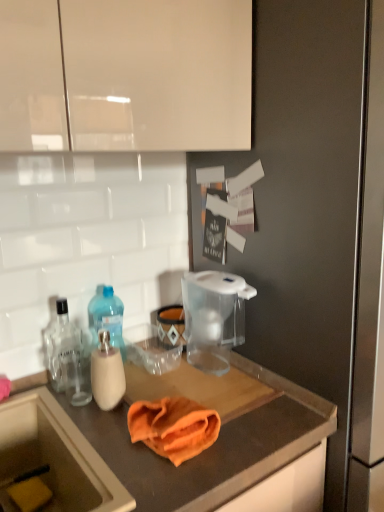
Question: From the image's perspective, is transparent plastic pitcher at upper center below translucent plastic bottle at left, the 1th bottle positioned from the right?

Choices:
 (A) no
 (B) yes

Answer: (B)

Question: Is translucent plastic bottle at left, which is the second bottle in left-to-right order, located within transparent plastic pitcher at upper center?

Choices:
 (A) no
 (B) yes

Answer: (A)

Question: Are transparent plastic pitcher at upper center and translucent plastic bottle at left, the 1th bottle positioned from the right, located far from each other?

Choices:
 (A) yes
 (B) no

Answer: (B)

Question: From a real-world perspective, is transparent plastic pitcher at upper center under translucent plastic bottle at left, the 1th bottle positioned from the right?

Choices:
 (A) yes
 (B) no

Answer: (A)

Question: Is transparent plastic pitcher at upper center positioned beyond the bounds of translucent plastic bottle at left, which is the second bottle in left-to-right order?

Choices:
 (A) yes
 (B) no

Answer: (A)

Question: Is transparent plastic pitcher at upper center at the right side of translucent plastic bottle at left, the 1th bottle positioned from the right?

Choices:
 (A) yes
 (B) no

Answer: (A)

Question: Is clear glass bottle at left, marked as the 1th bottle in a left-to-right arrangement, positioned beyond the bounds of transparent plastic water filter pitcher at center?

Choices:
 (A) yes
 (B) no

Answer: (A)

Question: Is clear glass bottle at left, which is the 2th bottle from right to left, next to transparent plastic water filter pitcher at center and touching it?

Choices:
 (A) no
 (B) yes

Answer: (A)

Question: Can you confirm if clear glass bottle at left, marked as the 1th bottle in a left-to-right arrangement, is positioned to the left of transparent plastic water filter pitcher at center?

Choices:
 (A) yes
 (B) no

Answer: (A)

Question: Is clear glass bottle at left, marked as the 1th bottle in a left-to-right arrangement, closer to the viewer compared to transparent plastic water filter pitcher at center?

Choices:
 (A) yes
 (B) no

Answer: (B)

Question: Is clear glass bottle at left, which is the 2th bottle from right to left, aimed at transparent plastic water filter pitcher at center?

Choices:
 (A) no
 (B) yes

Answer: (A)

Question: Can you confirm if clear glass bottle at left, which is the 2th bottle from right to left, is shorter than transparent plastic water filter pitcher at center?

Choices:
 (A) yes
 (B) no

Answer: (A)

Question: Could you tell me if orange microfiber cloth at center is turned towards yellow sponge at lower left?

Choices:
 (A) no
 (B) yes

Answer: (A)